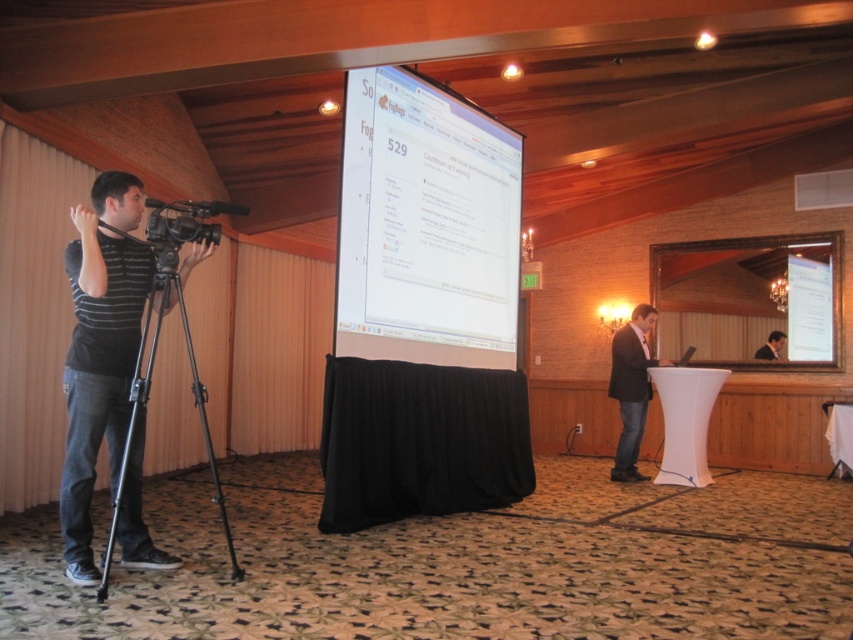
Looking at this image, does black matte tripod at left have a greater height compared to smooth skin face at center?

Indeed, black matte tripod at left has a greater height compared to smooth skin face at center.

Does black matte tripod at left appear under smooth skin face at center?

Yes.

Is point (154, 296) behind point (775, 346)?

No, it is in front of (775, 346).

You are a GUI agent. You are given a task and a screenshot of the screen. Output one action in this format:
    pyautogui.click(x=<x>, y=<y>)
    Task: Click on the black matte tripod at left
    This screenshot has height=640, width=853.
    Given the screenshot: What is the action you would take?
    pyautogui.click(x=149, y=390)

Between white fabric podium at center and dark gray suit at center, which one has more height?

With more height is dark gray suit at center.

Where is `white fabric podium at center`? The image size is (853, 640). white fabric podium at center is located at coordinates (685, 420).

Describe the element at coordinates (685, 420) in the screenshot. I see `white fabric podium at center` at that location.

Locate an element on the screen. The width and height of the screenshot is (853, 640). white fabric podium at center is located at coordinates (685, 420).

You are a GUI agent. You are given a task and a screenshot of the screen. Output one action in this format:
    pyautogui.click(x=<x>, y=<y>)
    Task: Click on the white fabric podium at center
    Image resolution: width=853 pixels, height=640 pixels.
    Given the screenshot: What is the action you would take?
    pyautogui.click(x=685, y=420)